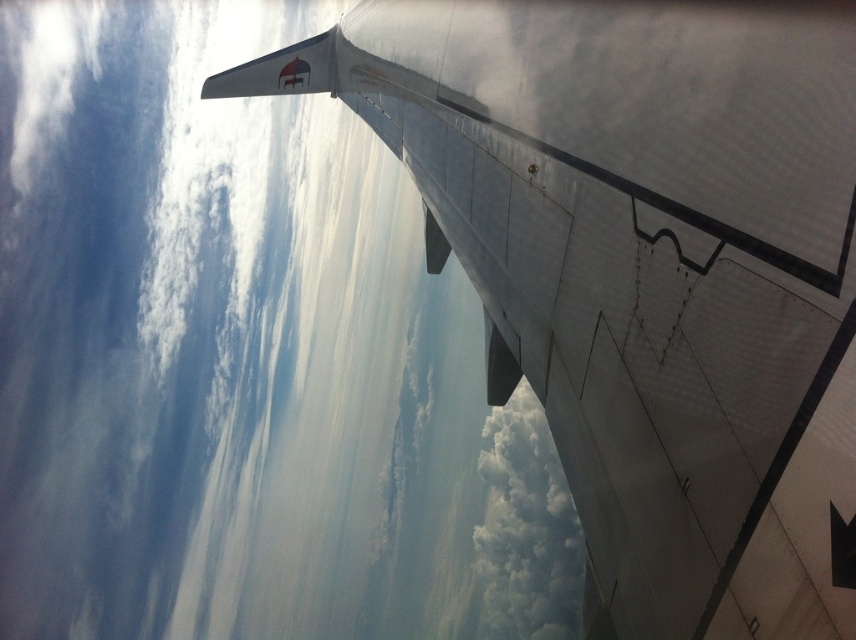
You are a passenger sitting in the airplane and looking out the window. You see the white matte wing at upper center and the metallic silver wing at upper right. Which wing is closer to the left side of the window?

The white matte wing at upper center is closer to the left side of the window because it is positioned to the left of the metallic silver wing at upper right.

In the scene shown: You are sitting in an airplane seat and notice a point at coordinates (242, 360) on the window. What object is located at that point?

The point at coordinates (242, 360) corresponds to the white matte wing at upper center.

You are a pilot who needs to ensure there is enough space between the white matte wing at upper center and the white fluffy cloud at upper center to avoid collision. Based on aviation safety standards, the minimum safe distance is 10 meters. Can the plane safely fly without hitting the cloud?

The distance between the white matte wing at upper center and the white fluffy cloud at upper center is 9.23 meters, which is less than the required 10 meters for safe flying. Therefore, the plane cannot safely fly without risking collision with the cloud.